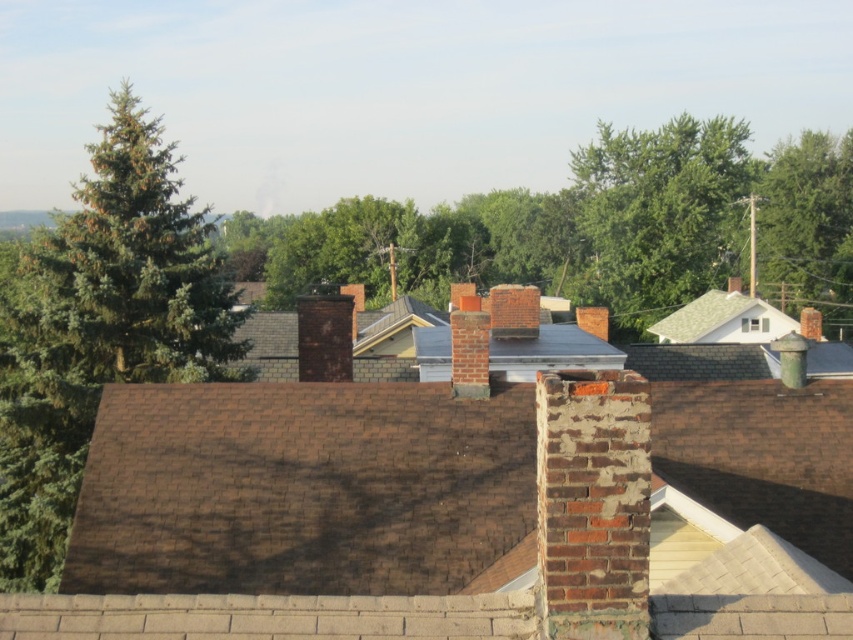
You are standing on the rooftop with green shingles at upper right and want to throw a ball to a friend standing under the green leafy tree at center. If the ball can travel 25 meters, will it reach your friend?

The green leafy tree at center is 25.98 meters from green shingles at upper right. Since the ball can only travel 25 meters, it will not reach your friend.

You are standing on the rooftop of a building and looking towards the green shingles at upper right and gray shingles at center. Which of the two shingles is closer to you?

The green shingles at upper right are closer to you because the gray shingles at center are positioned behind them.